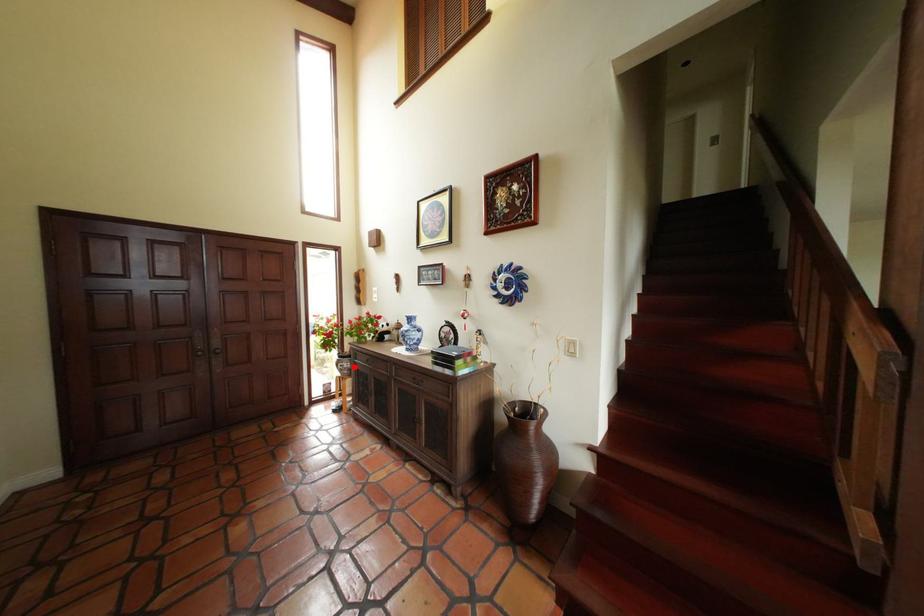
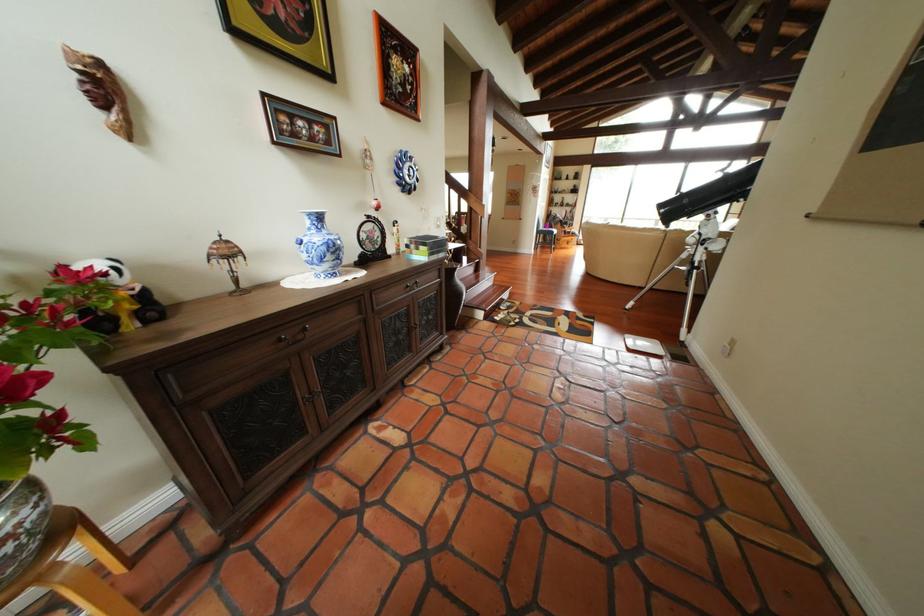
Question: I am providing you with two images of the same scene from different viewpoints. In image1, a red point is highlighted. Considering the same 3D point in image2, which of the following is correct?

Choices:
 (A) It is closer
 (B) It is farther

Answer: (A)